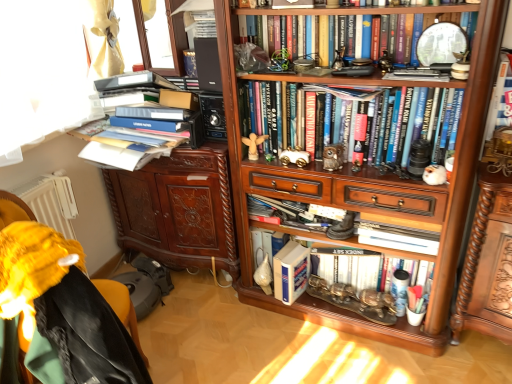
At what (x,y) coordinates should I click in order to perform the action: click on transparent glass window at upper left. Please return your answer as a coordinate pair (x, y). The height and width of the screenshot is (384, 512). Looking at the image, I should click on (161, 38).

Identify the location of white matte book at center, marked as the 2th book in a bottom-to-top arrangement. (362, 278).

What do you see at coordinates (362, 278) in the screenshot?
I see `white matte book at center, marked as the 2th book in a bottom-to-top arrangement` at bounding box center [362, 278].

Measure the distance between point (170,131) and camera.

The distance of point (170,131) from camera is 5.96 feet.

In order to face matte white shell at center, the first toy ordered from the bottom, should I rotate leftwards or rightwards?

It's best to rotate right around 1.186 degrees.

What do you see at coordinates (481, 260) in the screenshot? The width and height of the screenshot is (512, 384). I see `wooden carved shelf at lower right` at bounding box center [481, 260].

The height and width of the screenshot is (384, 512). Find the location of `wooden carved shelf at lower right`. wooden carved shelf at lower right is located at coordinates (481, 260).

What do you see at coordinates (362, 173) in the screenshot? I see `wooden bookcase at center` at bounding box center [362, 173].

Describe the element at coordinates (293, 117) in the screenshot. I see `hardcover books at center, the 3th book ordered from the bottom` at that location.

In order to face metallic silver car at center, which appears as the 4th toy when viewed from the back, should I rotate leftwards or rightwards?

Rotate your view right by about 10.682°.

Identify the location of transparent glass window at upper left. (161, 38).

Is point (506, 66) behind point (308, 158)?

That is False.

Looking at this image, between hardcover book at upper right, which is counted as the fourth book, starting from the bottom, and gold metallic car at center, the third toy in the back-to-front sequence, which one has larger size?

hardcover book at upper right, which is counted as the fourth book, starting from the bottom, is bigger.

From the image's perspective, is hardcover book at upper right, which appears as the 2th book when viewed from the top, located above or below gold metallic car at center, which ranks as the 2th toy in front-to-back order?

From the image's perspective, hardcover book at upper right, which appears as the 2th book when viewed from the top, appears above gold metallic car at center, which ranks as the 2th toy in front-to-back order.

Measure the distance between hardcover book at upper right, which appears as the 2th book when viewed from the top, and gold metallic car at center, which ranks as the 3th toy in bottom-to-top order.

A distance of 27.61 inches exists between hardcover book at upper right, which appears as the 2th book when viewed from the top, and gold metallic car at center, which ranks as the 3th toy in bottom-to-top order.

From their relative heights in the image, would you say hardcover books at center, which ranks as the 3th book in top-to-bottom order, is taller or shorter than wooden angel at center, the fourth toy when ordered from bottom to top?

hardcover books at center, which ranks as the 3th book in top-to-bottom order, is taller than wooden angel at center, the fourth toy when ordered from bottom to top.

How many degrees apart are the facing directions of hardcover books at center, the 3th book ordered from the bottom, and wooden angel at center, the fourth toy when ordered from bottom to top?

hardcover books at center, the 3th book ordered from the bottom, and wooden angel at center, the fourth toy when ordered from bottom to top, are facing 28.3 degrees away from each other.

Based on the photo, which of these two, hardcover books at center, which ranks as the 3th book in top-to-bottom order, or wooden angel at center, which is the 1th toy from top to bottom, is wider?

With larger width is hardcover books at center, which ranks as the 3th book in top-to-bottom order.

From the wooden angel at center, the first toy viewed from the left, count 3rd books forward and point to it. Please provide its 2D coordinates.

[(293, 117)]

In the scene shown: In the image, is hardcover book at upper right, which appears as the 2th book when viewed from the top, positioned in front of or behind matte white shell at center, the fourth toy when ordered from top to bottom?

Clearly, hardcover book at upper right, which appears as the 2th book when viewed from the top, is in front of matte white shell at center, the fourth toy when ordered from top to bottom.

Considering the relative sizes of hardcover book at upper right, which appears as the 2th book when viewed from the top, and matte white shell at center, marked as the 4th toy in a front-to-back arrangement, in the image provided, is hardcover book at upper right, which appears as the 2th book when viewed from the top, taller than matte white shell at center, marked as the 4th toy in a front-to-back arrangement,?

Correct, hardcover book at upper right, which appears as the 2th book when viewed from the top, is much taller as matte white shell at center, marked as the 4th toy in a front-to-back arrangement.

From a real-world perspective, between hardcover book at upper right, which is counted as the fourth book, starting from the bottom, and matte white shell at center, marked as the 3th toy in a right-to-left arrangement, who is vertically higher?

hardcover book at upper right, which is counted as the fourth book, starting from the bottom, is physically above.

Which object is positioned more to the left, matte white shell at center, which ranks as the first toy in back-to-front order, or white matte book at center, acting as the 4th book starting from the top?

From the viewer's perspective, matte white shell at center, which ranks as the first toy in back-to-front order, appears more on the left side.

Do you think matte white shell at center, the second toy viewed from the left, is within white matte book at center, marked as the 2th book in a bottom-to-top arrangement, or outside of it?

matte white shell at center, the second toy viewed from the left, is spatially situated outside white matte book at center, marked as the 2th book in a bottom-to-top arrangement.

In terms of size, does matte white shell at center, marked as the 3th toy in a right-to-left arrangement, appear bigger or smaller than white matte book at center, marked as the 2th book in a bottom-to-top arrangement?

Clearly, matte white shell at center, marked as the 3th toy in a right-to-left arrangement, is smaller in size than white matte book at center, marked as the 2th book in a bottom-to-top arrangement.

Is matte white shell at center, the fourth toy when ordered from top to bottom, placed right next to white matte book at center, marked as the 2th book in a bottom-to-top arrangement?

Answer: No, matte white shell at center, the fourth toy when ordered from top to bottom, is not with white matte book at center, marked as the 2th book in a bottom-to-top arrangement.

Which object is closer to the camera taking this photo, velvet yellow chair at lower left or hardcover book at upper center, which is the fifth book in bottom-to-top order?

velvet yellow chair at lower left is in front.

From a real-world perspective, which is physically below, velvet yellow chair at lower left or hardcover book at upper center, which is counted as the first book, starting from the top?

velvet yellow chair at lower left.

Identify the location of the 1st book behind the velvet yellow chair at lower left, starting your count from the anchor. The image size is (512, 384). (303, 15).

Do you think velvet yellow chair at lower left is within hardcover book at upper center, which is the fifth book in bottom-to-top order, or outside of it?

velvet yellow chair at lower left is spatially situated outside hardcover book at upper center, which is the fifth book in bottom-to-top order.

Is white matte book at center, marked as the 2th book in a bottom-to-top arrangement, far away from wooden carved shelf at lower right?

No, white matte book at center, marked as the 2th book in a bottom-to-top arrangement, is not far away from wooden carved shelf at lower right.

Is white matte book at center, marked as the 2th book in a bottom-to-top arrangement, behind wooden carved shelf at lower right?

Yes, white matte book at center, marked as the 2th book in a bottom-to-top arrangement, is behind wooden carved shelf at lower right.

Is white matte book at center, marked as the 2th book in a bottom-to-top arrangement, wider than wooden carved shelf at lower right?

No.

In the scene shown: Considering the positions of objects white matte book at center, acting as the 4th book starting from the top, and wooden carved shelf at lower right in the image provided, who is more to the right, white matte book at center, acting as the 4th book starting from the top, or wooden carved shelf at lower right?

wooden carved shelf at lower right.

At what (x,y) coordinates should I click in order to perform the action: click on the 3rd book in front of the black matte speaker at upper center, starting your count from the anchor. Please return your answer as a coordinate pair (x, y). Looking at the image, I should click on (293, 117).

From a real-world perspective, is black matte speaker at upper center beneath hardcover books at center, which ranks as the 3th book in top-to-bottom order?

Incorrect, from a real-world perspective, black matte speaker at upper center is higher than hardcover books at center, which ranks as the 3th book in top-to-bottom order.

Is black matte speaker at upper center placed right next to hardcover books at center, which ranks as the 3th book in top-to-bottom order?

No, black matte speaker at upper center is not in contact with hardcover books at center, which ranks as the 3th book in top-to-bottom order.

At what (x,y) coordinates should I click in order to perform the action: click on the 2nd toy counting from the left of the hardcover book at upper right, which is counted as the fourth book, starting from the bottom. Please return your answer as a coordinate pair (x, y). This screenshot has height=384, width=512. Looking at the image, I should click on (294, 157).

Starting from the hardcover books at center, which ranks as the 3th book in top-to-bottom order, which toy is the 3rd one behind? Please provide its 2D coordinates.

[(253, 144)]

From the image, which object appears to be farther from wooden angel at center, placed as the 2th toy when sorted from back to front, wooden bookcase at center or white matte book at center, marked as the 2th book in a bottom-to-top arrangement?

Based on the image, white matte book at center, marked as the 2th book in a bottom-to-top arrangement, appears to be further to wooden angel at center, placed as the 2th toy when sorted from back to front.

From the image, which object appears to be farther from blue hardcover book at center, which is counted as the first book, starting from the bottom, black matte speaker at upper center or wooden carved shelf at lower right?

black matte speaker at upper center is positioned further to the anchor blue hardcover book at center, which is counted as the first book, starting from the bottom.

Estimate the real-world distances between objects in this image. Which object is further from metallic silver car at center, the 1th toy viewed from the right, brown carved cabinet at left or gold metallic car at center, which ranks as the 3th toy in bottom-to-top order?

brown carved cabinet at left is further to metallic silver car at center, the 1th toy viewed from the right.

Estimate the real-world distances between objects in this image. Which object is further from matte white shell at center, marked as the 4th toy in a front-to-back arrangement, black matte speaker at upper center or hardcover book at upper right, which appears as the 2th book when viewed from the top?

hardcover book at upper right, which appears as the 2th book when viewed from the top.

Considering their positions, is blue matte book at upper left positioned closer to gold metallic car at center, which is the 2th toy from right to left, than wooden bookcase at center?

wooden bookcase at center lies closer to gold metallic car at center, which is the 2th toy from right to left, than the other object.

From the image, which object appears to be farther from transparent glass window at upper left, metallic silver car at center, the 1th toy viewed from the right, or brown carved cabinet at left?

metallic silver car at center, the 1th toy viewed from the right, is positioned further to the anchor transparent glass window at upper left.

Which object lies nearer to the anchor point blue matte book at upper left, matte white shell at center, marked as the 4th toy in a front-to-back arrangement, or metallic silver car at center, which appears as the 4th toy when viewed from the back?

Based on the image, metallic silver car at center, which appears as the 4th toy when viewed from the back, appears to be nearer to blue matte book at upper left.

Which object lies further to the anchor point blue hardcover book at center, which ranks as the fifth book in top-to-bottom order, brown carved cabinet at left or hardcover book at upper center, which is the fifth book in bottom-to-top order?

Among the two, hardcover book at upper center, which is the fifth book in bottom-to-top order, is located further to blue hardcover book at center, which ranks as the fifth book in top-to-bottom order.

Identify the location of animal between hardcover book at upper right, which is counted as the fourth book, starting from the bottom, and white matte book at center, acting as the 4th book starting from the top, in the vertical direction. The height and width of the screenshot is (384, 512). (435, 175).

The width and height of the screenshot is (512, 384). Find the location of `bookcase between black matte speaker at upper center and wooden carved shelf at lower right`. bookcase between black matte speaker at upper center and wooden carved shelf at lower right is located at coordinates (362, 173).

The height and width of the screenshot is (384, 512). What are the coordinates of `chair between black matte speaker at upper center and matte white shell at center, the first toy ordered from the bottom, in the vertical direction` in the screenshot? It's located at (61, 307).

This screenshot has width=512, height=384. I want to click on speaker between hardcover book at upper center, which is the fifth book in bottom-to-top order, and blue hardcover book at center, which is counted as the first book, starting from the bottom, in the up-down direction, so click(208, 64).